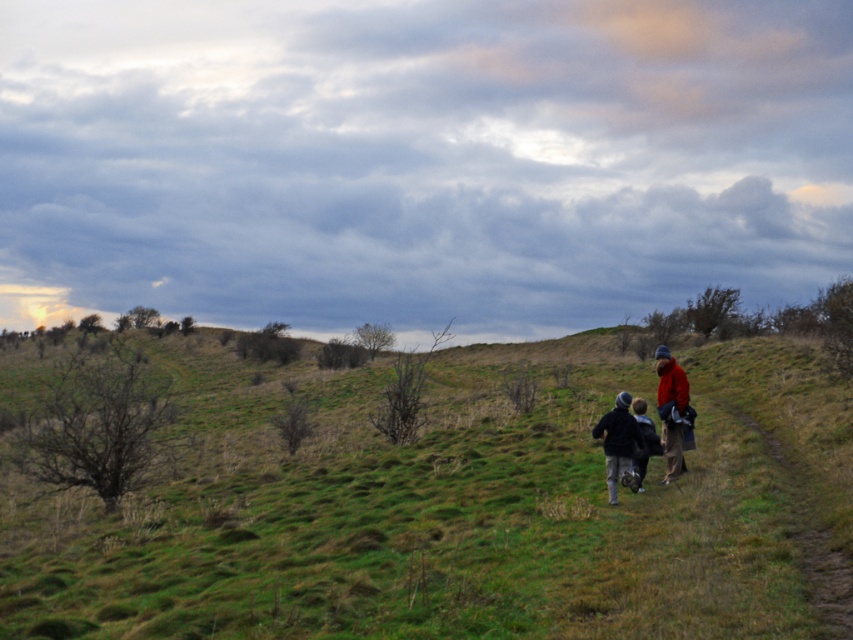
You are standing at the starting point of the path and want to reach the dark blue jacket at center. Which direction should you walk to avoid the green grassy hillside at center?

The green grassy hillside at center is located below the dark blue jacket at center. To avoid the hillside, walk towards the dark blue jacket at center while staying on the path above the green grassy hillside at center.

You are standing at the camera position and want to walk towards the dirt path at right. Based on the scene description, which direction should you move relative to your current position?

The dirt path at right is located at point (x=808, y=525), so you should move towards the right and forward to reach it.

You are standing at the starting point of the dirt path at right and want to catch up with the group wearing the red woolen jacket at right. Which direction should you walk to reach them?

The dirt path at right is to the right of the red woolen jacket at right, so you should walk to the left along the dirt path at right to reach them.